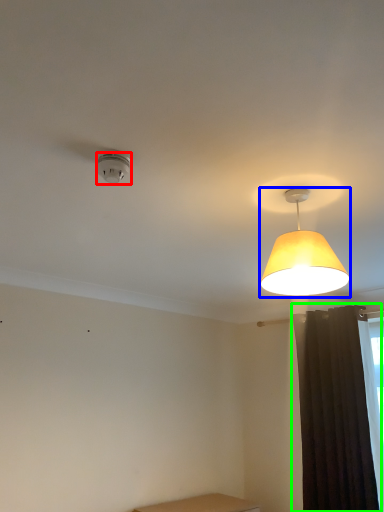
Question: Which is farther away from lamp (highlighted by a red box)? lamp (highlighted by a blue box) or curtain (highlighted by a green box)?

Choices:
 (A) lamp
 (B) curtain

Answer: (B)